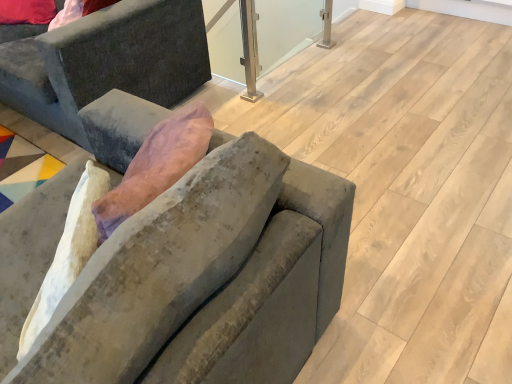
Locate an element on the screen. free location to the right of velvet gray couch at center, which appears as the first studio couch when viewed from the front is located at coordinates (401, 271).